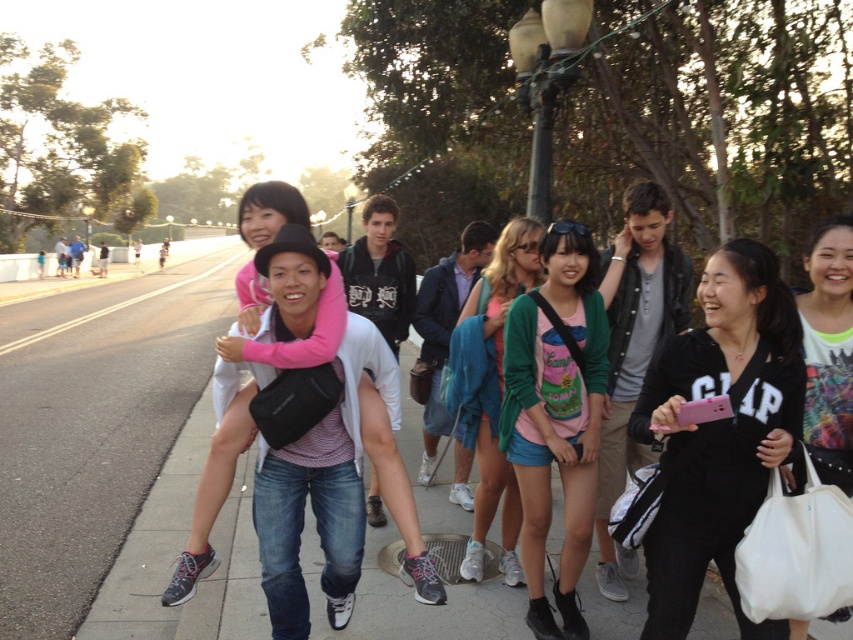
You are a photographer trying to capture a photo of the matte green sweater at center and the white fabric bag at lower right. Since you want both objects to appear equally sized in the photo, which object should you move closer to?

The matte green sweater at center is much taller than the white fabric bag at lower right. To make them appear the same size in the photo, you should move closer to the white fabric bag at lower right, as it is smaller and needs to be magnified more to match the size of the taller sweater.